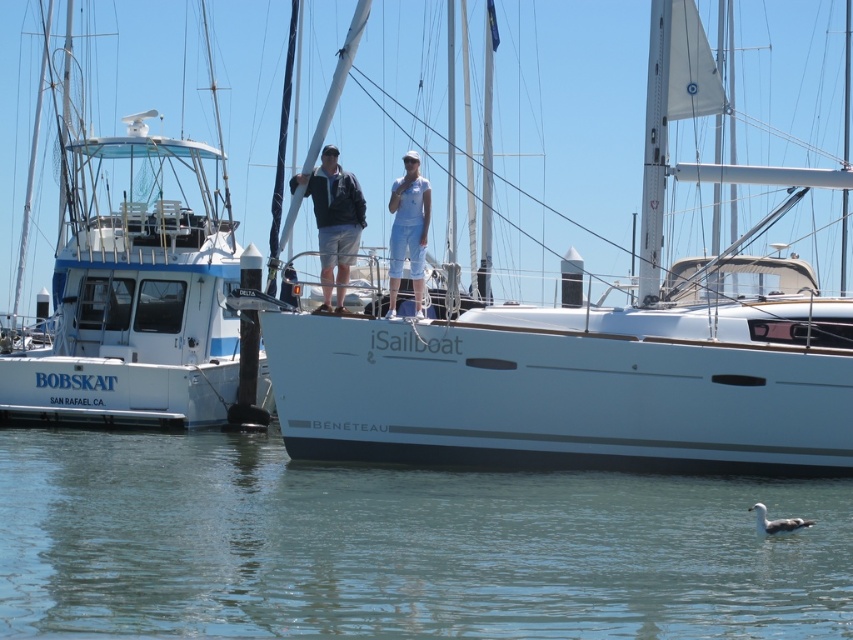
Is point (50, 369) positioned after point (389, 198)?

No, (50, 369) is in front of (389, 198).

Can you confirm if white matte boat at left is shorter than white cotton shirt at center?

Incorrect, white matte boat at left's height does not fall short of white cotton shirt at center's.

Is point (68, 333) positioned in front of point (393, 196)?

No, (68, 333) is further to viewer.

I want to click on white matte boat at left, so click(x=135, y=292).

Can you confirm if clear blue water at lower center is bigger than light blue denim shorts at center?

Indeed, clear blue water at lower center has a larger size compared to light blue denim shorts at center.

Can you confirm if clear blue water at lower center is positioned above light blue denim shorts at center?

No, clear blue water at lower center is not above light blue denim shorts at center.

Does point (267, 451) lie behind point (339, 209)?

Yes, point (267, 451) is farther from viewer.

You are a GUI agent. You are given a task and a screenshot of the screen. Output one action in this format:
    pyautogui.click(x=<x>, y=<y>)
    Task: Click on the clear blue water at lower center
    
    Given the screenshot: What is the action you would take?
    pyautogui.click(x=397, y=547)

Is point (61, 564) closer to camera compared to point (415, 227)?

Yes, it is in front of point (415, 227).

Is point (373, 548) more distant than point (396, 264)?

No, it is in front of (396, 264).

Identify the location of clear blue water at lower center. This screenshot has width=853, height=640. (397, 547).